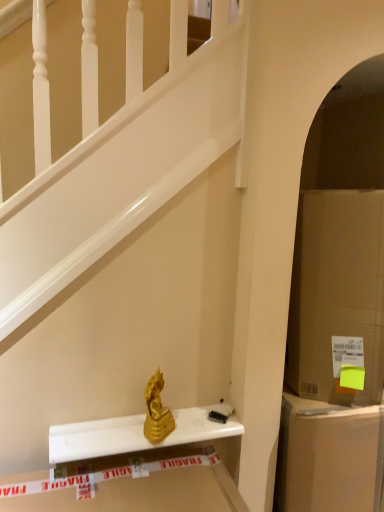
What do you see at coordinates (157, 411) in the screenshot? The height and width of the screenshot is (512, 384). I see `gold metallic statue at center` at bounding box center [157, 411].

The height and width of the screenshot is (512, 384). Describe the element at coordinates (136, 434) in the screenshot. I see `gold metallic statue at center` at that location.

What do you see at coordinates (327, 457) in the screenshot? The width and height of the screenshot is (384, 512). I see `cardboard box at right` at bounding box center [327, 457].

The width and height of the screenshot is (384, 512). What do you see at coordinates (337, 293) in the screenshot?
I see `cardboard box at right` at bounding box center [337, 293].

The height and width of the screenshot is (512, 384). I want to click on gold metallic statue at center, so tap(157, 411).

Is gold metallic statue at center thinner than cardboard box at right?

Yes.

Consider the image. From a real-world perspective, which object rests below the other?

cardboard box at right is physically lower.

Between point (167, 432) and point (367, 423), which one is positioned in front?

The point (167, 432) is in front.

At what (x,y) coordinates should I click in order to perform the action: click on cabinet behind the gold metallic statue at center. Please return your answer as a coordinate pair (x, y). The width and height of the screenshot is (384, 512). Looking at the image, I should click on (327, 457).

Is cardboard box at right next to cardboard box at right and touching it?

No, cardboard box at right is not beside cardboard box at right.

From the image's perspective, which is above, cardboard box at right or cardboard box at right?

cardboard box at right appears higher in the image.

Is point (320, 499) farther from viewer compared to point (377, 392)?

No.

Which is in front, cardboard box at right or cardboard box at right?

cardboard box at right is more forward.

Locate an element on the screen. window sill below the gold metallic statue at center (from a real-world perspective) is located at coordinates (136, 434).

Which of these two, gold metallic statue at center or gold metallic statue at center, is thinner?

gold metallic statue at center is thinner.

Is gold metallic statue at center smaller than gold metallic statue at center?

Incorrect, gold metallic statue at center is not smaller in size than gold metallic statue at center.

Is cardboard box at right facing towards gold metallic statue at center?

No, cardboard box at right is not facing towards gold metallic statue at center.

Is cardboard box at right next to gold metallic statue at center?

No, cardboard box at right is not touching gold metallic statue at center.

From the image's perspective, relative to gold metallic statue at center, is cardboard box at right above or below?

cardboard box at right is below gold metallic statue at center.

Consider the image. Can you confirm if cardboard box at right is wider than gold metallic statue at center?

Yes, cardboard box at right is wider than gold metallic statue at center.

From the image's perspective, between cardboard box at right and cardboard box at right, which one is located above?

cardboard box at right, from the image's perspective.

Does point (317, 390) come farther from viewer compared to point (312, 461)?

Yes.

Does cardboard box at right contain cardboard box at right?

Actually, cardboard box at right is outside cardboard box at right.

Is cardboard box at right oriented towards cardboard box at right?

No, cardboard box at right is not facing towards cardboard box at right.

Based on the photo, from a real-world perspective, is cardboard box at right below gold metallic statue at center?

No, from a real-world perspective, cardboard box at right is not beneath gold metallic statue at center.

Is cardboard box at right not close to gold metallic statue at center?

No, cardboard box at right is in close proximity to gold metallic statue at center.

Would you say cardboard box at right is outside gold metallic statue at center?

Indeed, cardboard box at right is completely outside gold metallic statue at center.

From their relative heights in the image, would you say cardboard box at right is taller or shorter than gold metallic statue at center?

Clearly, cardboard box at right is taller compared to gold metallic statue at center.

Which object is positioned more to the left, gold metallic statue at center or cardboard box at right?

gold metallic statue at center.

Is gold metallic statue at center looking in the opposite direction of cardboard box at right?

gold metallic statue at center is not turned away from cardboard box at right.

Is gold metallic statue at center located outside cardboard box at right?

Yes, gold metallic statue at center is not within cardboard box at right.

Which object is closer to the camera taking this photo, gold metallic statue at center or cardboard box at right?

cardboard box at right is closer to the camera.

You are a GUI agent. You are given a task and a screenshot of the screen. Output one action in this format:
    pyautogui.click(x=<x>, y=<y>)
    Task: Click on the sculpture that is above the cardboard box at right (from a real-world perspective)
    This screenshot has height=512, width=384.
    Given the screenshot: What is the action you would take?
    pyautogui.click(x=157, y=411)

The height and width of the screenshot is (512, 384). Identify the location of cabinet below the cardboard box at right (from the image's perspective). (327, 457).

Looking at the image, which one is located further to gold metallic statue at center, cardboard box at right or gold metallic statue at center?

cardboard box at right is positioned further to the anchor gold metallic statue at center.

Which object lies further to the anchor point gold metallic statue at center, gold metallic statue at center or cardboard box at right?

Based on the image, cardboard box at right appears to be further to gold metallic statue at center.

From the image, which object appears to be farther from gold metallic statue at center, cardboard box at right or cardboard box at right?

Among the two, cardboard box at right is located further to gold metallic statue at center.

Looking at the image, which one is located closer to gold metallic statue at center, cardboard box at right or gold metallic statue at center?

gold metallic statue at center lies closer to gold metallic statue at center than the other object.

Looking at the image, which one is located closer to gold metallic statue at center, cardboard box at right or cardboard box at right?

Among the two, cardboard box at right is located nearer to gold metallic statue at center.

From the picture: Considering their positions, is cardboard box at right positioned further to gold metallic statue at center than cardboard box at right?

cardboard box at right is positioned further to the anchor gold metallic statue at center.

When comparing their distances from cardboard box at right, does cardboard box at right or gold metallic statue at center seem further?

Based on the image, gold metallic statue at center appears to be further to cardboard box at right.

Looking at the image, which one is located closer to gold metallic statue at center, gold metallic statue at center or cardboard box at right?

gold metallic statue at center is positioned closer to the anchor gold metallic statue at center.

This screenshot has width=384, height=512. I want to click on cabinet between gold metallic statue at center and cardboard box at right in the horizontal direction, so click(327, 457).

Where is `cabinet between gold metallic statue at center and cardboard box at right`? This screenshot has width=384, height=512. cabinet between gold metallic statue at center and cardboard box at right is located at coordinates (327, 457).

This screenshot has width=384, height=512. I want to click on sculpture between gold metallic statue at center and cardboard box at right, so click(x=157, y=411).

Where is `sculpture located between gold metallic statue at center and cardboard box at right in the left-right direction`? This screenshot has width=384, height=512. sculpture located between gold metallic statue at center and cardboard box at right in the left-right direction is located at coordinates (157, 411).